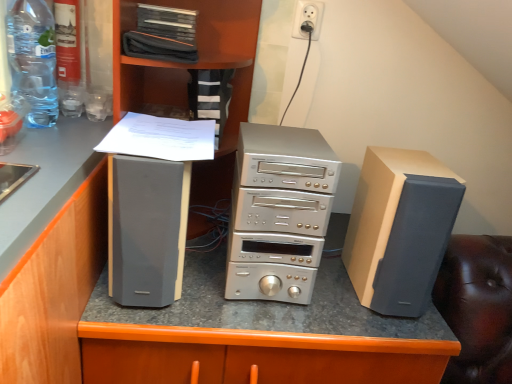
Question: Is white paper at center not inside matte gray speaker at left?

Choices:
 (A) yes
 (B) no

Answer: (B)

Question: From a real-world perspective, is white paper at center positioned over matte gray speaker at left based on gravity?

Choices:
 (A) yes
 (B) no

Answer: (A)

Question: Can you confirm if white paper at center is taller than matte gray speaker at left?

Choices:
 (A) no
 (B) yes

Answer: (A)

Question: Is white paper at center next to matte gray speaker at left?

Choices:
 (A) no
 (B) yes

Answer: (A)

Question: Does white paper at center have a lesser width compared to matte gray speaker at left?

Choices:
 (A) yes
 (B) no

Answer: (B)

Question: From the image's perspective, is white plastic socket at upper center located above or below satin silver electronics at center?

Choices:
 (A) above
 (B) below

Answer: (A)

Question: Would you say white plastic socket at upper center is inside or outside satin silver electronics at center?

Choices:
 (A) outside
 (B) inside

Answer: (A)

Question: Considering the positions of white plastic socket at upper center and satin silver electronics at center in the image, is white plastic socket at upper center bigger or smaller than satin silver electronics at center?

Choices:
 (A) small
 (B) big

Answer: (A)

Question: Is point (314, 13) positioned closer to the camera than point (185, 360)?

Choices:
 (A) farther
 (B) closer

Answer: (A)

Question: From the image's perspective, is black fabric case at upper center above or below matte black speaker at left?

Choices:
 (A) below
 (B) above

Answer: (B)

Question: Looking at the image, does black fabric case at upper center seem bigger or smaller compared to matte black speaker at left?

Choices:
 (A) big
 (B) small

Answer: (B)

Question: Relative to matte black speaker at left, is black fabric case at upper center in front or behind?

Choices:
 (A) front
 (B) behind

Answer: (B)

Question: Is point (241, 66) positioned closer to the camera than point (228, 183)?

Choices:
 (A) farther
 (B) closer

Answer: (B)

Question: Is point (365, 309) positioned closer to the camera than point (14, 61)?

Choices:
 (A) farther
 (B) closer

Answer: (A)

Question: Considering the positions of satin silver electronics at center and transparent plastic bottle at upper left in the image, is satin silver electronics at center bigger or smaller than transparent plastic bottle at upper left?

Choices:
 (A) big
 (B) small

Answer: (A)